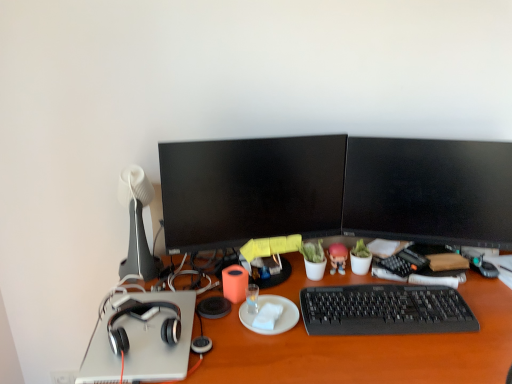
At what (x,y) coordinates should I click in order to perform the action: click on free space above black matte keyboard at lower right (from a real-world perspective). Please return your answer as a coordinate pair (x, y). The height and width of the screenshot is (384, 512). Looking at the image, I should click on tap(381, 301).